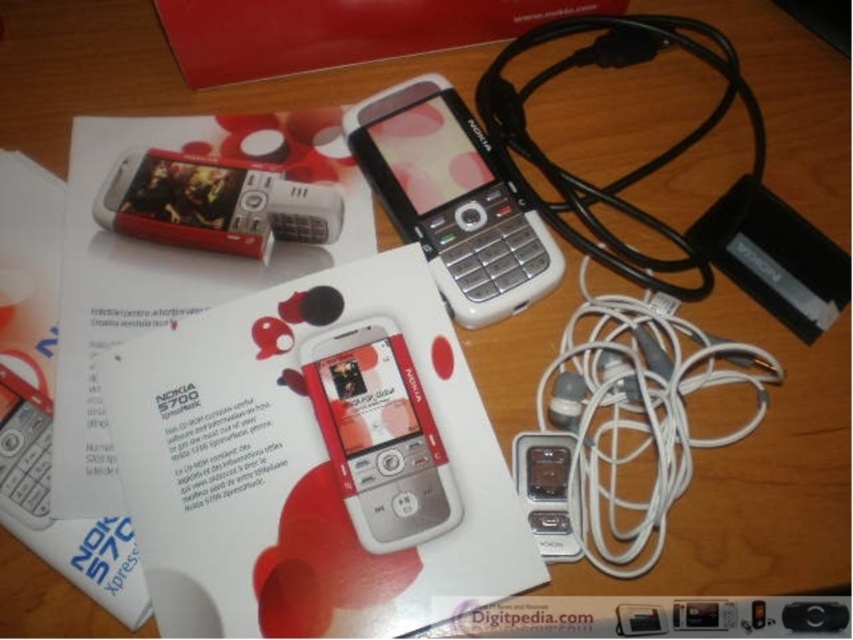
Question: Does white matte nokia phone at center appear over white plastic nokia phone at upper center?

Choices:
 (A) no
 (B) yes

Answer: (B)

Question: Which of the following is the farthest from the observer?

Choices:
 (A) satin silver ipod at lower center
 (B) white plastic nokia phone at upper center
 (C) white matte nokia phone at center
 (D) silver metallic smartphone at center

Answer: (B)

Question: Among these points, which one is farthest from the camera?

Choices:
 (A) (573, 509)
 (B) (463, 196)

Answer: (B)

Question: Which object is farther from the camera taking this photo?

Choices:
 (A) white matte nokia phone at center
 (B) silver metallic smartphone at center
 (C) satin silver ipod at lower center
 (D) white plastic nokia phone at upper center

Answer: (D)

Question: Is the position of silver metallic smartphone at center more distant than that of satin silver ipod at lower center?

Choices:
 (A) yes
 (B) no

Answer: (B)

Question: Does white plastic nokia phone at upper center have a lesser width compared to satin silver ipod at lower center?

Choices:
 (A) no
 (B) yes

Answer: (A)